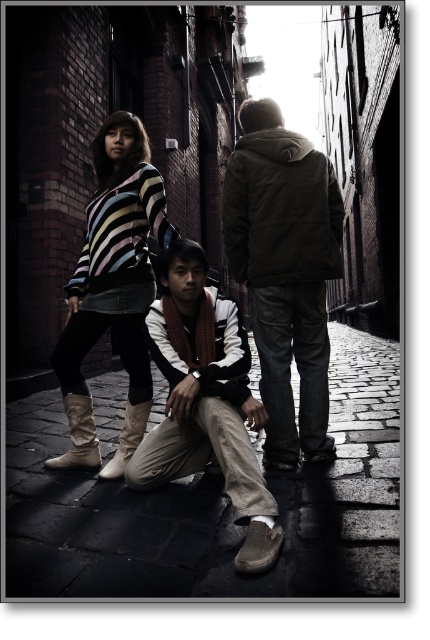
Question: Is tan suede scarf at center below striped sweater at center?

Choices:
 (A) yes
 (B) no

Answer: (A)

Question: Which is nearer to the tan suede scarf at center?

Choices:
 (A) dark brown leather jacket at center
 (B) striped sweater at center
 (C) dark stone pavement at center

Answer: (B)

Question: Which object appears closest to the camera in this image?

Choices:
 (A) dark stone pavement at center
 (B) striped sweater at center

Answer: (A)

Question: Is dark brown leather jacket at center wider than striped sweater at center?

Choices:
 (A) yes
 (B) no

Answer: (A)

Question: Observing the image, what is the correct spatial positioning of dark brown leather jacket at center in reference to tan suede scarf at center?

Choices:
 (A) below
 (B) above

Answer: (B)

Question: Which of the following is the farthest from the observer?

Choices:
 (A) striped sweater at center
 (B) tan suede scarf at center

Answer: (A)